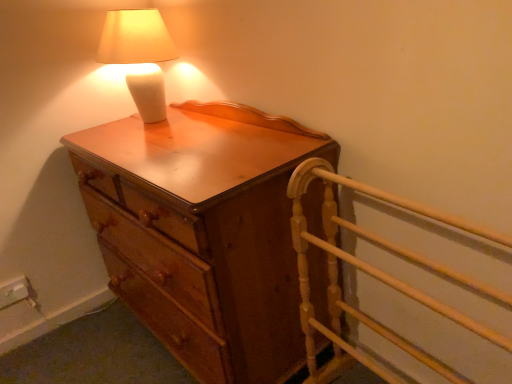
Question: Should I look upward or downward to see wooden chest of drawers at center?

Choices:
 (A) up
 (B) down

Answer: (B)

Question: Should I look upward or downward to see matte white lamp at upper left?

Choices:
 (A) up
 (B) down

Answer: (A)

Question: Does light wood bed frame at right appear on the left side of matte white lamp at upper left?

Choices:
 (A) yes
 (B) no

Answer: (B)

Question: Can you confirm if light wood bed frame at right is wider than matte white lamp at upper left?

Choices:
 (A) yes
 (B) no

Answer: (A)

Question: Considering the relative sizes of light wood bed frame at right and matte white lamp at upper left in the image provided, is light wood bed frame at right bigger than matte white lamp at upper left?

Choices:
 (A) yes
 (B) no

Answer: (A)

Question: From the image's perspective, is light wood bed frame at right beneath matte white lamp at upper left?

Choices:
 (A) yes
 (B) no

Answer: (A)

Question: From the image's perspective, is light wood bed frame at right on top of matte white lamp at upper left?

Choices:
 (A) yes
 (B) no

Answer: (B)

Question: Is matte white lamp at upper left at the back of light wood bed frame at right?

Choices:
 (A) no
 (B) yes

Answer: (A)

Question: Is light wood bed frame at right facing away from wooden chest of drawers at center?

Choices:
 (A) yes
 (B) no

Answer: (B)

Question: From a real-world perspective, is light wood bed frame at right on top of wooden chest of drawers at center?

Choices:
 (A) yes
 (B) no

Answer: (B)

Question: Is light wood bed frame at right oriented towards wooden chest of drawers at center?

Choices:
 (A) no
 (B) yes

Answer: (A)

Question: Can you confirm if light wood bed frame at right is wider than wooden chest of drawers at center?

Choices:
 (A) no
 (B) yes

Answer: (A)

Question: Is light wood bed frame at right bigger than wooden chest of drawers at center?

Choices:
 (A) no
 (B) yes

Answer: (A)

Question: Is light wood bed frame at right shorter than wooden chest of drawers at center?

Choices:
 (A) no
 (B) yes

Answer: (B)

Question: Is matte white lamp at upper left aimed at light wood bed frame at right?

Choices:
 (A) no
 (B) yes

Answer: (A)